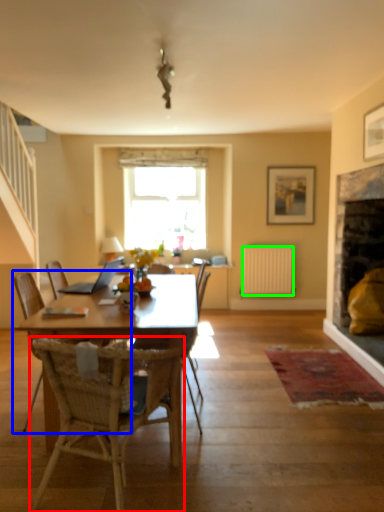
Question: Which object is the closest to the chair (highlighted by a red box)? Choose among these: chair (highlighted by a blue box) or radiator (highlighted by a green box).

Choices:
 (A) chair
 (B) radiator

Answer: (A)